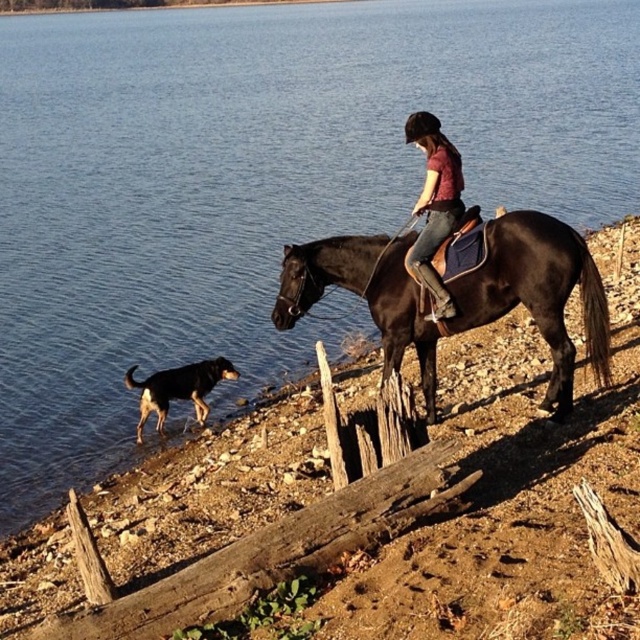
Where is `denim jeans at center`? The image size is (640, 640). denim jeans at center is located at coordinates (435, 204).

Is denim jeans at center below black and tan fur dog at lower left?

Actually, denim jeans at center is above black and tan fur dog at lower left.

Identify the location of denim jeans at center. The width and height of the screenshot is (640, 640). (435, 204).

Where is `denim jeans at center`? denim jeans at center is located at coordinates (435, 204).

Is shiny dark brown horse at upper center shorter than denim jeans at center?

Incorrect, shiny dark brown horse at upper center's height does not fall short of denim jeans at center's.

Does shiny dark brown horse at upper center have a lesser width compared to denim jeans at center?

Incorrect, shiny dark brown horse at upper center's width is not less than denim jeans at center's.

Is point (364, 262) more distant than point (448, 305)?

Yes, it is behind point (448, 305).

Identify the location of shiny dark brown horse at upper center. (461, 294).

Is point (476, 301) farther from viewer compared to point (228, 360)?

That is False.

Who is more distant from viewer, (429,380) or (136,442)?

Point (136,442)

The image size is (640, 640). What do you see at coordinates (461, 294) in the screenshot?
I see `shiny dark brown horse at upper center` at bounding box center [461, 294].

In order to click on shiny dark brown horse at upper center in this screenshot , I will do `click(461, 294)`.